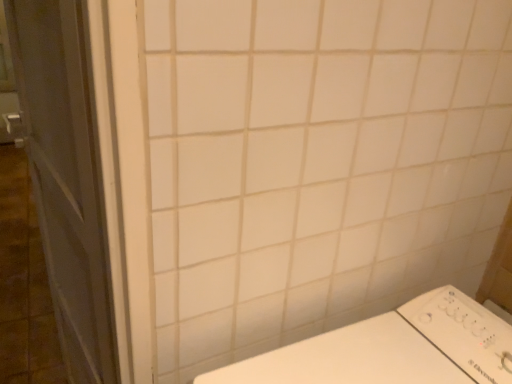
Question: Should I look upward or downward to see matte gray screen door at left?

Choices:
 (A) down
 (B) up

Answer: (A)